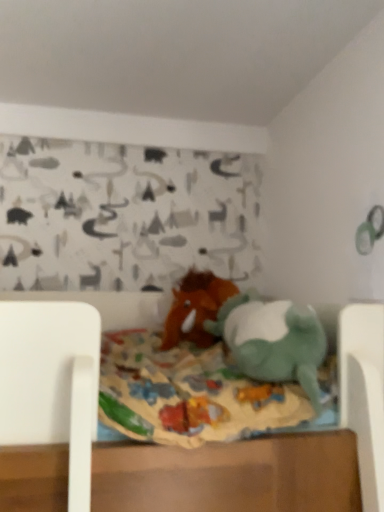
Question: In which direction should I rotate to look at brown plush horse at center, acting as the first toy starting from the back?

Choices:
 (A) left
 (B) right

Answer: (B)

Question: Does green plush toy at center, the 1th toy from the front, turn towards brown plush horse at center, acting as the first toy starting from the back?

Choices:
 (A) no
 (B) yes

Answer: (A)

Question: Is the depth of green plush toy at center, arranged as the 2th toy when viewed from the back, greater than that of brown plush horse at center, acting as the first toy starting from the back?

Choices:
 (A) no
 (B) yes

Answer: (A)

Question: Can you confirm if green plush toy at center, the 1th toy from the front, is bigger than brown plush horse at center, acting as the first toy starting from the back?

Choices:
 (A) yes
 (B) no

Answer: (A)

Question: Does green plush toy at center, arranged as the 2th toy when viewed from the back, lie in front of brown plush horse at center, acting as the first toy starting from the back?

Choices:
 (A) no
 (B) yes

Answer: (B)

Question: From a real-world perspective, does green plush toy at center, the 1th toy from the front, stand above brown plush horse at center, arranged as the second toy when viewed from the front?

Choices:
 (A) no
 (B) yes

Answer: (A)

Question: Does green plush toy at center, the 1th toy from the front, have a lesser width compared to brown plush horse at center, acting as the first toy starting from the back?

Choices:
 (A) no
 (B) yes

Answer: (B)

Question: Can you confirm if brown plush horse at center, arranged as the second toy when viewed from the front, is shorter than green plush toy at center, the 1th toy from the front?

Choices:
 (A) no
 (B) yes

Answer: (A)

Question: From a real-world perspective, is brown plush horse at center, arranged as the second toy when viewed from the front, over green plush toy at center, the 1th toy from the front?

Choices:
 (A) yes
 (B) no

Answer: (A)

Question: From the image's perspective, is brown plush horse at center, acting as the first toy starting from the back, located beneath green plush toy at center, arranged as the 2th toy when viewed from the back?

Choices:
 (A) no
 (B) yes

Answer: (A)

Question: From a real-world perspective, is brown plush horse at center, arranged as the second toy when viewed from the front, located beneath green plush toy at center, arranged as the 2th toy when viewed from the back?

Choices:
 (A) no
 (B) yes

Answer: (A)

Question: Can green plush toy at center, arranged as the 2th toy when viewed from the back, be found inside brown plush horse at center, acting as the first toy starting from the back?

Choices:
 (A) yes
 (B) no

Answer: (B)

Question: Is brown plush horse at center, acting as the first toy starting from the back, in contact with green plush toy at center, arranged as the 2th toy when viewed from the back?

Choices:
 (A) yes
 (B) no

Answer: (B)

Question: Choose the correct answer: Is brown plush horse at center, acting as the first toy starting from the back, inside green plush toy at center, the 1th toy from the front, or outside it?

Choices:
 (A) inside
 (B) outside

Answer: (B)